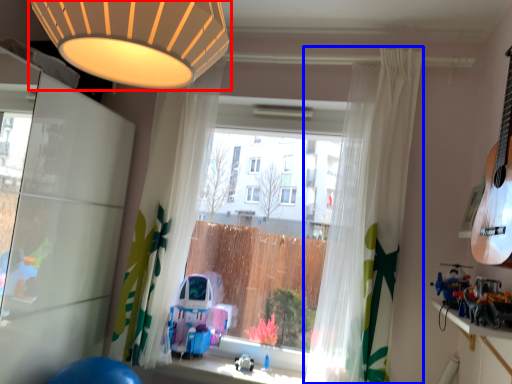
Question: Which object is closer to the camera taking this photo, lamp (highlighted by a red box) or curtain (highlighted by a blue box)?

Choices:
 (A) lamp
 (B) curtain

Answer: (A)